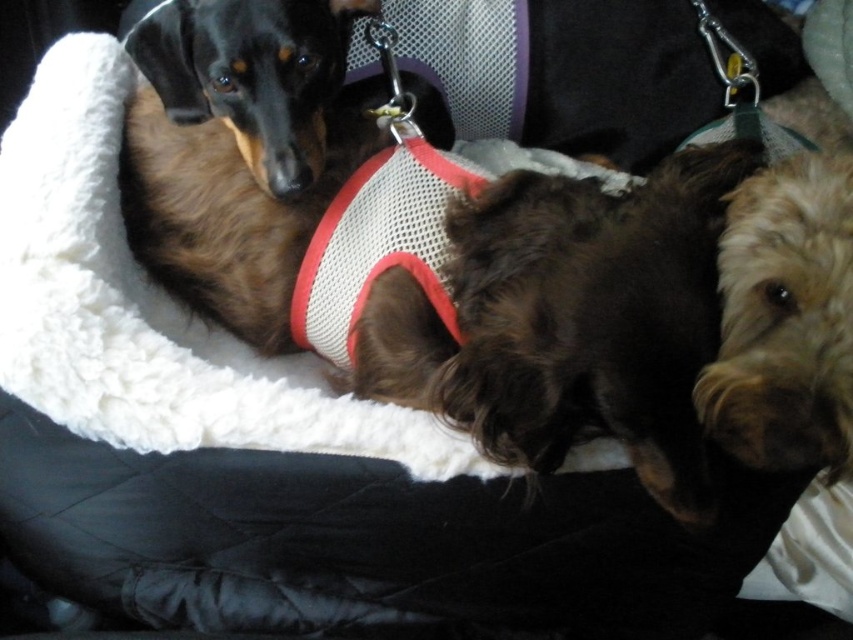
Question: Can you confirm if mesh fabric harness at center is smaller than brown fur dog at upper left?

Choices:
 (A) no
 (B) yes

Answer: (A)

Question: Which of the following is the closest to the observer?

Choices:
 (A) (228, 3)
 (B) (634, 28)

Answer: (A)

Question: Is mesh fabric harness at center to the right of brown fur dog at upper left from the viewer's perspective?

Choices:
 (A) no
 (B) yes

Answer: (B)

Question: Is mesh fabric harness at center to the left of brown fur dog at upper left from the viewer's perspective?

Choices:
 (A) no
 (B) yes

Answer: (A)